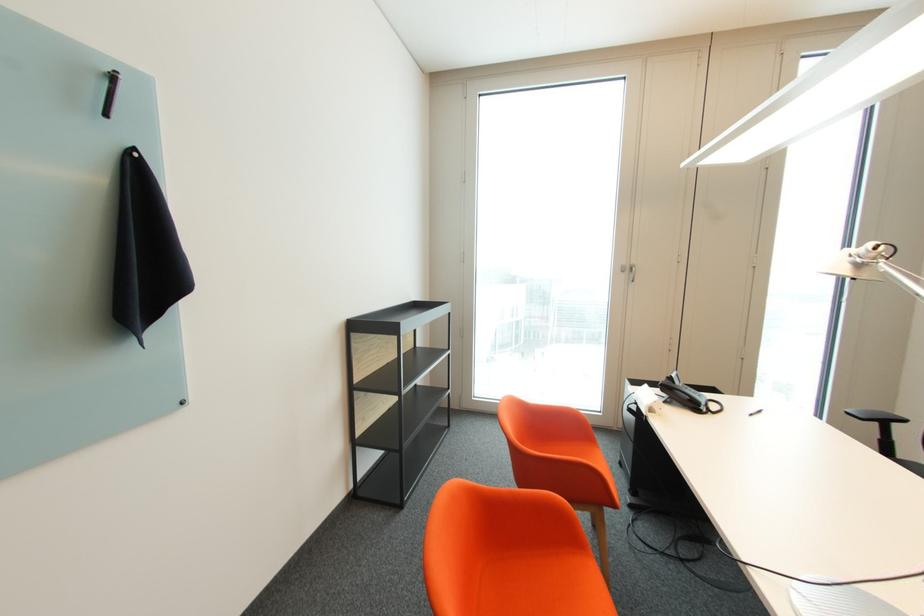
Image resolution: width=924 pixels, height=616 pixels. What do you see at coordinates (628, 270) in the screenshot?
I see `the window handle` at bounding box center [628, 270].